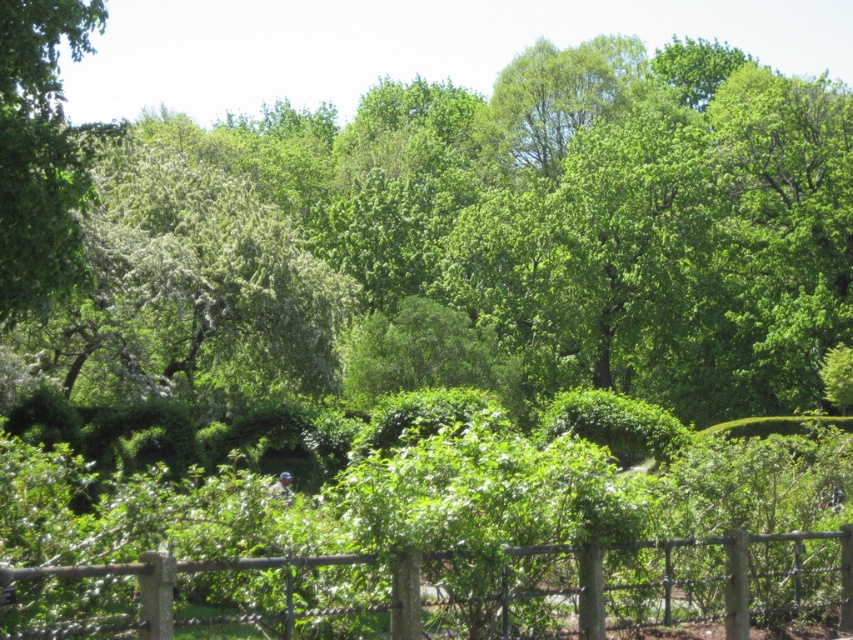
From the picture: You are standing in the lush green landscape and want to walk from the point at coordinates point [33,209] to the point at coordinates point [128,570]. Which direction should you move to get closer to your destination?

Since point [33,209] is further to the camera than point [128,570], you should move forward towards the background to reach your destination.

You are standing in the lush landscape and want to take a photo of the green leafy tree at left and the rustic wood fence at lower center. Which object should you focus on first if you want to capture both in a single frame without moving the camera?

The green leafy tree at left is bigger than the rustic wood fence at lower center, so you should focus on the green leafy tree at left first to ensure it fills the frame appropriately while still capturing the smaller rustic wood fence at lower center in the background.

You are standing in a lush garden and want to reach a specific point marked at coordinates point (x=55, y=257). Your current position is 10 meters away from this point. Can you safely walk directly to this point without encountering any obstacles?

The distance of point (x=55, y=257) from camera is 13.59 meters, so you are currently 10 meters away from it. Since the total distance is 13.59 meters, you have 3.59 meters remaining. However, the scene description mentions a wooden fence in the foreground and hedges in the midground which may block your path. Without specific information about the path being clear, it is uncertain if there are obstacles. The answer cannot be confirmed with the given data.